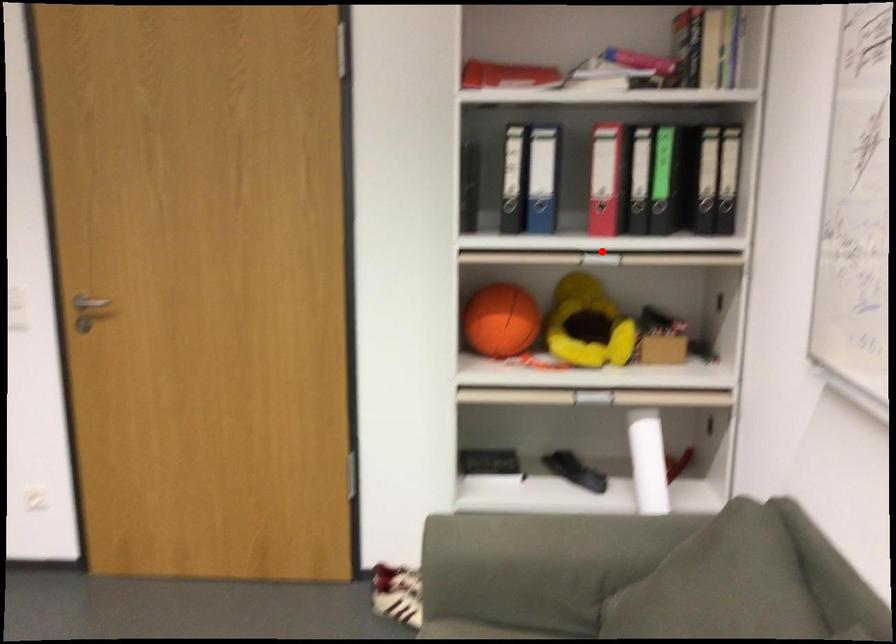
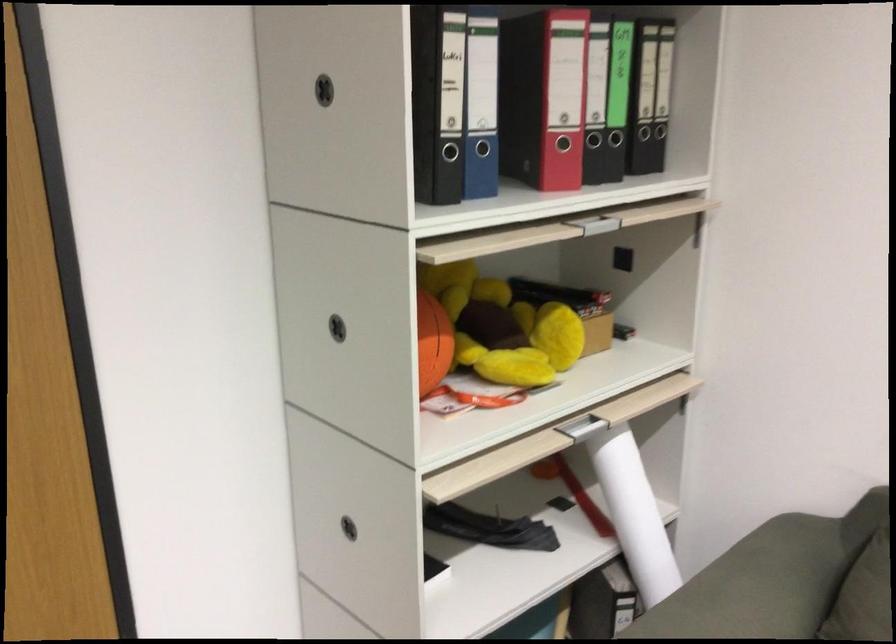
The point at the highlighted location is marked in the first image. Where is the corresponding point in the second image?

(573, 219)